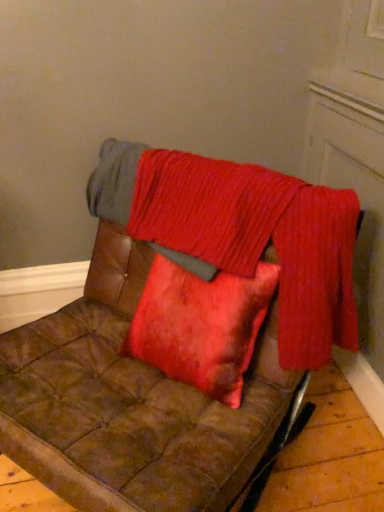
What do you see at coordinates (243, 233) in the screenshot?
I see `crinkled red fabric at upper center` at bounding box center [243, 233].

What is the approximate width of crinkled red fabric at upper center?

crinkled red fabric at upper center is 9.87 inches wide.

The height and width of the screenshot is (512, 384). I want to click on crinkled red fabric at upper center, so click(x=243, y=233).

Describe the element at coordinates (129, 404) in the screenshot. I see `brown leather chair at center` at that location.

At what (x,y) coordinates should I click in order to perform the action: click on brown leather chair at center. Please return your answer as a coordinate pair (x, y). The width and height of the screenshot is (384, 512). Looking at the image, I should click on (129, 404).

The width and height of the screenshot is (384, 512). I want to click on crinkled red fabric at upper center, so click(243, 233).

Would you say crinkled red fabric at upper center is to the left or to the right of brown leather chair at center in the picture?

crinkled red fabric at upper center is to the right of brown leather chair at center.

Which is behind, crinkled red fabric at upper center or brown leather chair at center?

crinkled red fabric at upper center.

Which is behind, point (339, 308) or point (127, 248)?

The point (127, 248) is farther.

From the image's perspective, who appears lower, crinkled red fabric at upper center or brown leather chair at center?

brown leather chair at center.

From a real-world perspective, which object rests below the other?

brown leather chair at center is physically lower.

Which of these two, crinkled red fabric at upper center or brown leather chair at center, is thinner?

crinkled red fabric at upper center is thinner.

Consider the image. Which of these two, crinkled red fabric at upper center or brown leather chair at center, stands shorter?

With less height is crinkled red fabric at upper center.

Is crinkled red fabric at upper center smaller than brown leather chair at center?

Yes.

Is crinkled red fabric at upper center inside or outside of brown leather chair at center?

crinkled red fabric at upper center is located inside brown leather chair at center.

Is crinkled red fabric at upper center touching brown leather chair at center?

No, crinkled red fabric at upper center is not beside brown leather chair at center.

Does crinkled red fabric at upper center turn towards brown leather chair at center?

Yes, crinkled red fabric at upper center is facing brown leather chair at center.

You are a GUI agent. You are given a task and a screenshot of the screen. Output one action in this format:
    pyautogui.click(x=<x>, y=<y>)
    Task: Click on the blanket that appears above the brown leather chair at center (from the image's perspective)
    This screenshot has width=384, height=512.
    Given the screenshot: What is the action you would take?
    pyautogui.click(x=243, y=233)

Considering the positions of objects brown leather chair at center and crinkled red fabric at upper center in the image provided, who is more to the right, brown leather chair at center or crinkled red fabric at upper center?

Positioned to the right is crinkled red fabric at upper center.

Looking at this image, between brown leather chair at center and crinkled red fabric at upper center, which one is positioned behind?

crinkled red fabric at upper center is further from the camera.

Which is behind, point (127, 439) or point (290, 344)?

Point (290, 344)

From the image's perspective, is brown leather chair at center located above or below crinkled red fabric at upper center?

Clearly, from the image's perspective, brown leather chair at center is below crinkled red fabric at upper center.

From a real-world perspective, does brown leather chair at center sit lower than crinkled red fabric at upper center?

Yes.

Is brown leather chair at center thinner than crinkled red fabric at upper center?

Incorrect, the width of brown leather chair at center is not less than that of crinkled red fabric at upper center.

Which of these two, brown leather chair at center or crinkled red fabric at upper center, stands taller?

brown leather chair at center.

Between brown leather chair at center and crinkled red fabric at upper center, which one has smaller size?

Smaller between the two is crinkled red fabric at upper center.

Would you say brown leather chair at center contains crinkled red fabric at upper center?

Yes, crinkled red fabric at upper center is inside brown leather chair at center.

Is brown leather chair at center positioned far away from crinkled red fabric at upper center?

brown leather chair at center is actually quite close to crinkled red fabric at upper center.

Does brown leather chair at center turn towards crinkled red fabric at upper center?

No, brown leather chair at center is not facing towards crinkled red fabric at upper center.

How distant is brown leather chair at center from crinkled red fabric at upper center?

They are 24.98 centimeters apart.

This screenshot has height=512, width=384. Find the location of `blanket above the brown leather chair at center (from a real-world perspective)`. blanket above the brown leather chair at center (from a real-world perspective) is located at coordinates (243, 233).

Where is `blanket behind the brown leather chair at center`? blanket behind the brown leather chair at center is located at coordinates (243, 233).

At what (x,y) coordinates should I click in order to perform the action: click on furniture on the left of crinkled red fabric at upper center. Please return your answer as a coordinate pair (x, y). The image size is (384, 512). Looking at the image, I should click on (129, 404).